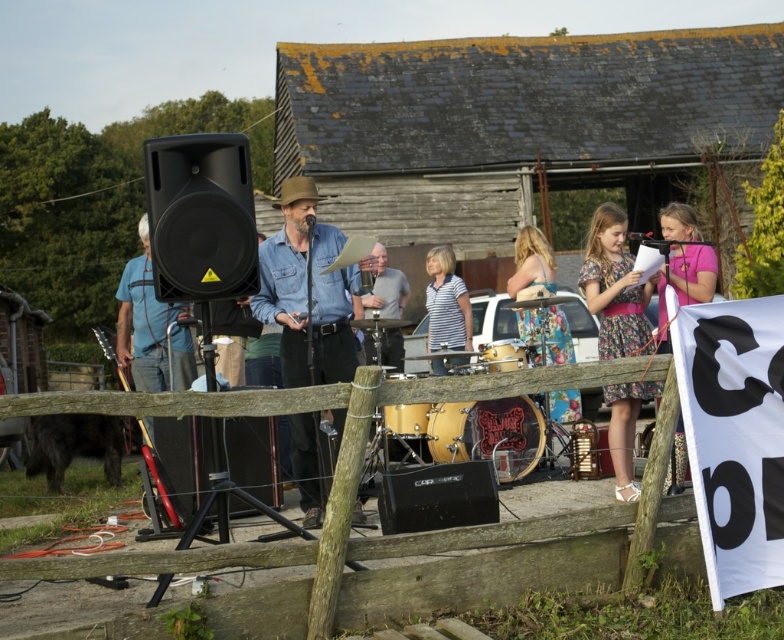
Question: Which object is closer to the camera taking this photo?

Choices:
 (A) matte brown drum at center
 (B) black matte speaker at center
 (C) wooden drum at center
 (D) gray matte shirt at center

Answer: (B)

Question: Is wooden fence at lower center below floral dress at right?

Choices:
 (A) no
 (B) yes

Answer: (B)

Question: Considering the relative positions of black matte speaker at left and striped cotton shirt at center in the image provided, where is black matte speaker at left located with respect to striped cotton shirt at center?

Choices:
 (A) below
 (B) above

Answer: (B)

Question: Does pink fabric dress at right appear on the right side of gray matte shirt at center?

Choices:
 (A) yes
 (B) no

Answer: (A)

Question: Considering the real-world distances, which object is farthest from the floral dress at center?

Choices:
 (A) black matte speaker at center
 (B) black drum at center

Answer: (A)

Question: Among these points, which one is nearest to the camera?

Choices:
 (A) (499, 365)
 (B) (467, 317)
 (C) (608, 276)

Answer: (C)